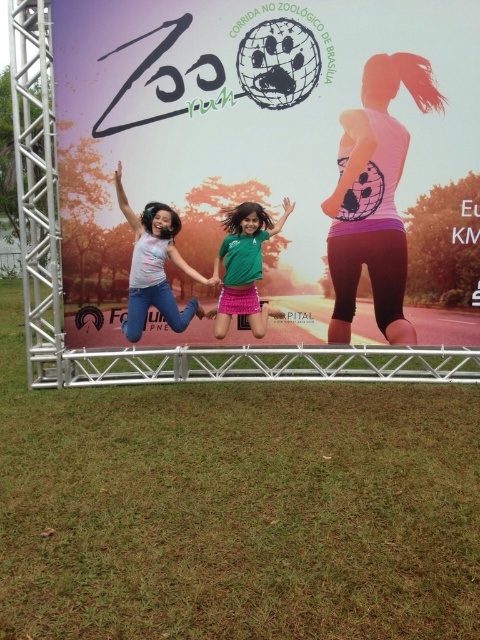
Question: Can you confirm if matte pink shirt at center is bigger than green matte skirt at center?

Choices:
 (A) no
 (B) yes

Answer: (B)

Question: Is pink matte tank top at upper right positioned at the back of matte pink shirt at center?

Choices:
 (A) no
 (B) yes

Answer: (B)

Question: Which of these objects is positioned farthest from the matte pink shirt at center?

Choices:
 (A) green matte skirt at center
 (B) matte white banner at center

Answer: (B)

Question: Which point appears farthest from the camera in this image?

Choices:
 (A) (141, 340)
 (B) (168, 324)
 (C) (402, 161)

Answer: (A)

Question: From the image, what is the correct spatial relationship of pink matte tank top at upper right in relation to matte pink shirt at center?

Choices:
 (A) right
 (B) left

Answer: (A)

Question: Which is farther from the matte white banner at center?

Choices:
 (A) pink matte tank top at upper right
 (B) matte pink shirt at center
 (C) green matte skirt at center

Answer: (B)